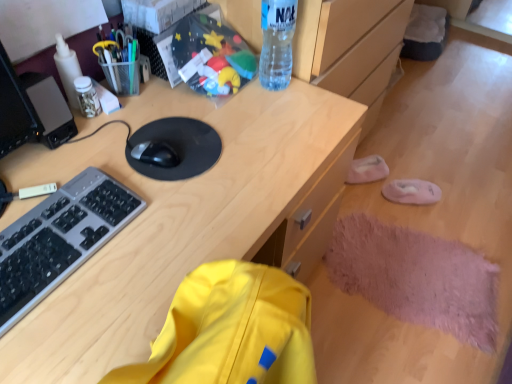
This screenshot has height=384, width=512. I want to click on vacant space in between transparent plastic bottle at upper center, the second bottle in the left-to-right sequence, and gray plastic keyboard at left, so click(x=193, y=135).